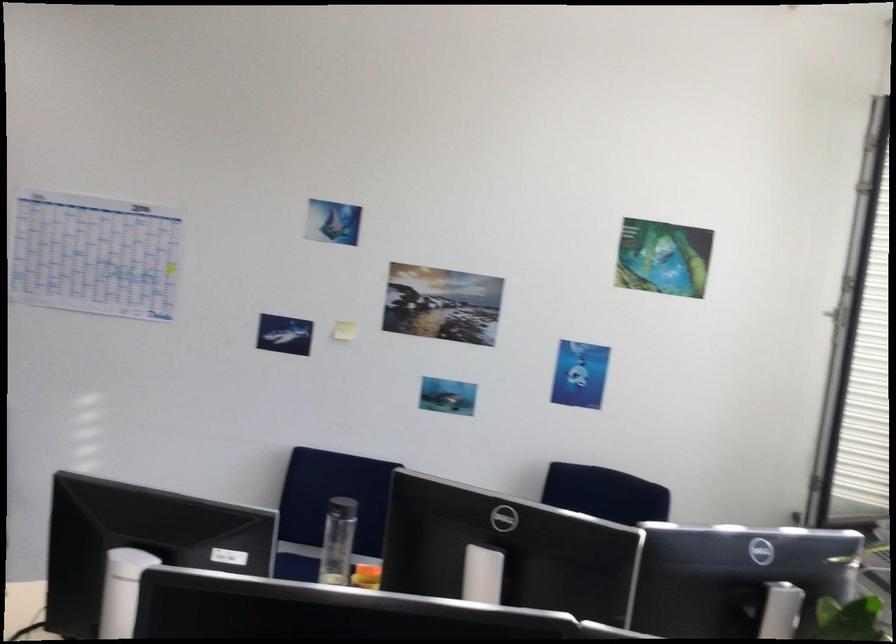
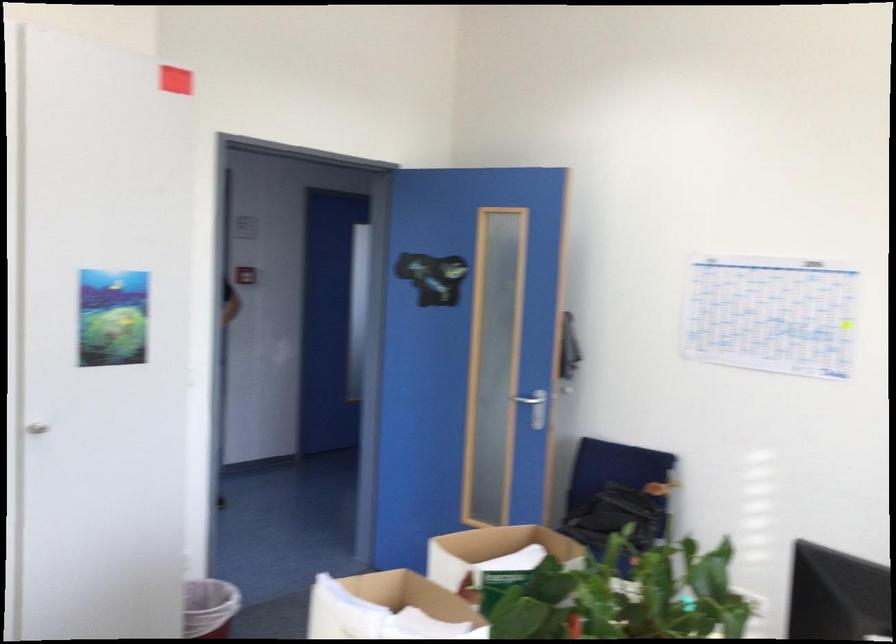
Question: The images are taken continuously from a first-person perspective. In which direction is your viewpoint rotating?

Choices:
 (A) Left
 (B) Right
 (C) Up
 (D) Down

Answer: (A)